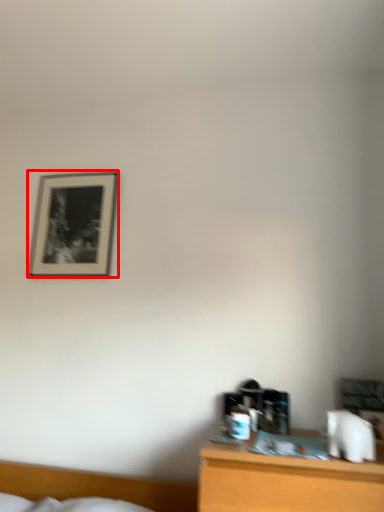
Question: Observing the image, what is the correct spatial positioning of picture frame (annotated by the red box) in reference to bed?

Choices:
 (A) right
 (B) left

Answer: (B)